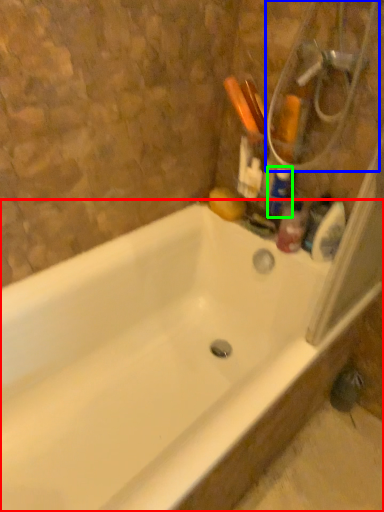
Question: Based on their relative distances, which object is nearer to bathtub (highlighted by a red box)? Choose from shower (highlighted by a blue box) and cleaning product (highlighted by a green box).

Choices:
 (A) shower
 (B) cleaning product

Answer: (B)